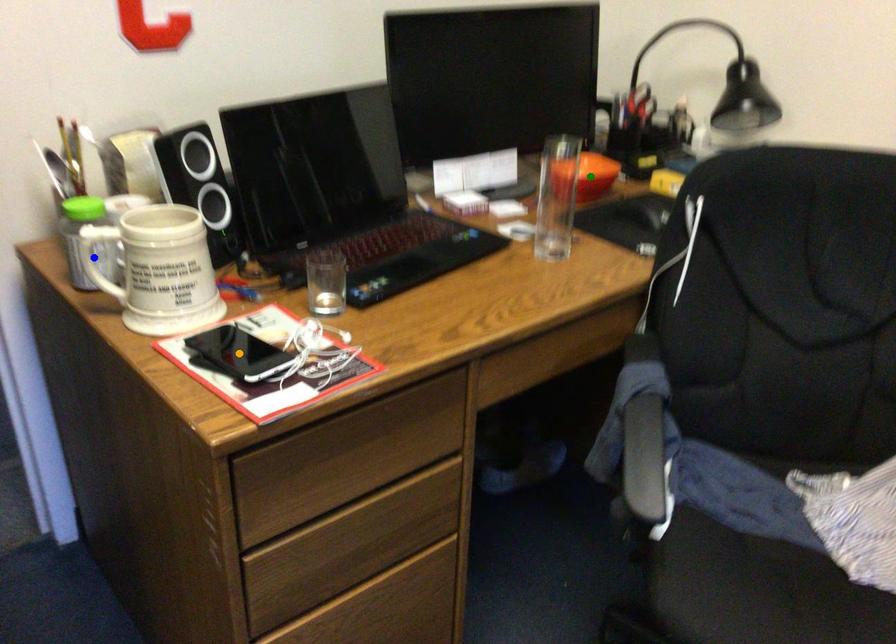
Order these from farthest to nearest:
blue point | green point | orange point

green point
blue point
orange point